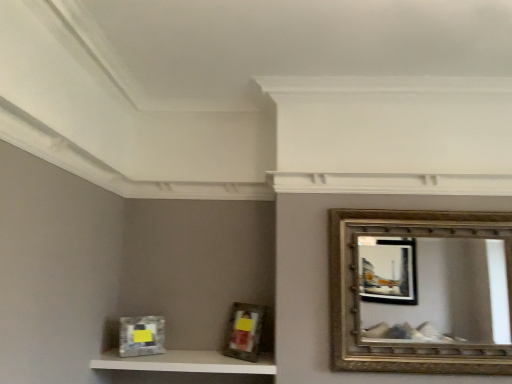
The width and height of the screenshot is (512, 384). In order to click on vacant area on top of gold textured mirror at upper right (from a real-world perspective) in this screenshot , I will do `click(438, 213)`.